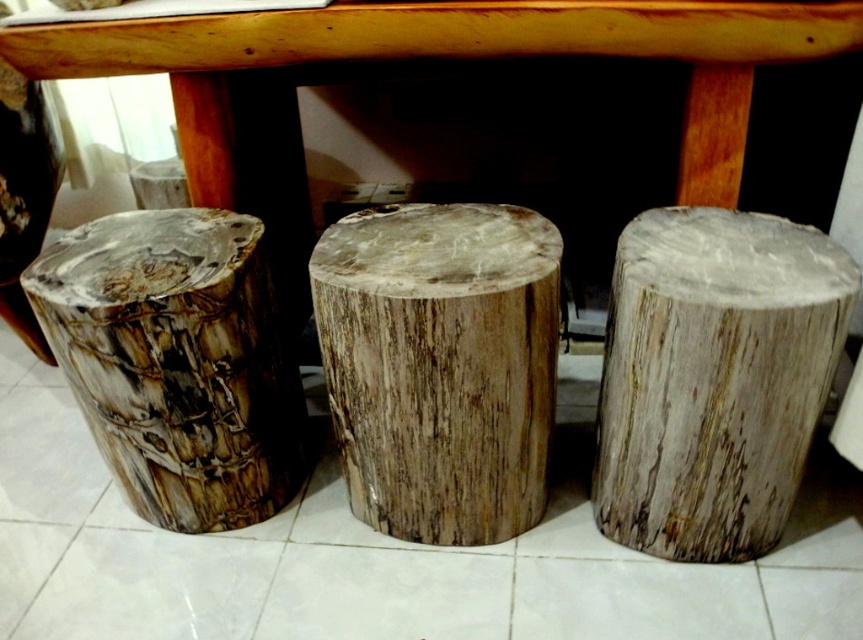
You are standing in a room with three cylindrical wooden stumps placed side by side on a tiled floor. You see a point marked at coordinates (715, 378). Which object does this point correspond to?

The point marked at coordinates (715, 378) corresponds to the natural wood stump at right.

You are standing in front of the three stumps and want to touch the natural wood stump at center and the fossilized wood stump at left. Which one can you reach without moving your feet?

The natural wood stump at center is closer to the viewer than the fossilized wood stump at left, so you can reach the natural wood stump at center without moving your feet.